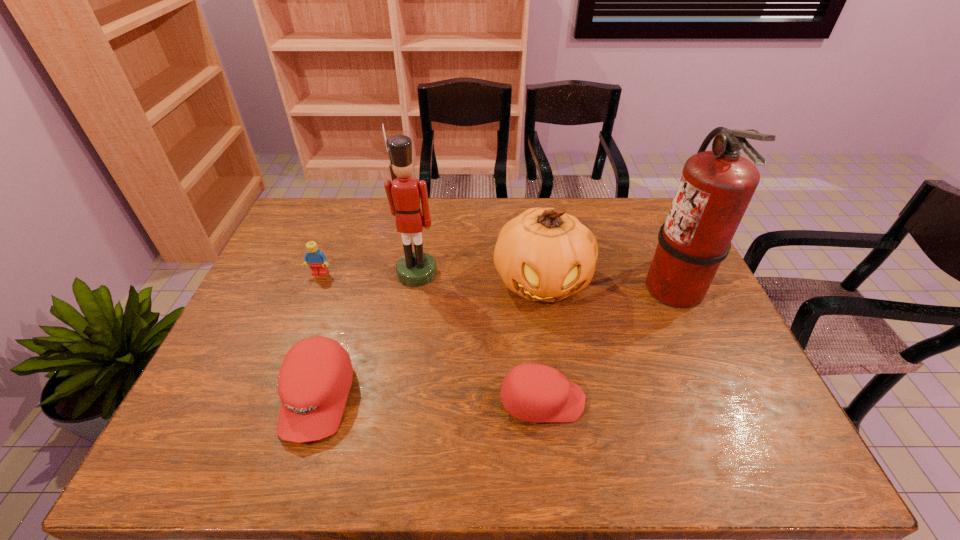
The image size is (960, 540). Find the location of `vacant region between the taller cap and the pumpkin`. vacant region between the taller cap and the pumpkin is located at coordinates (430, 340).

Find the location of a particular element. free space between the shorter cap and the nutcracker is located at coordinates (479, 337).

The width and height of the screenshot is (960, 540). Find the location of `the second closest object to the third object from left to right`. the second closest object to the third object from left to right is located at coordinates (317, 260).

Identify which object is the fifth nearest to the pumpkin. Please provide its 2D coordinates. Your answer should be formatted as a tuple, i.e. [(x, y)], where the tuple contains the x and y coordinates of a point satisfying the conditions above.

[(317, 260)]